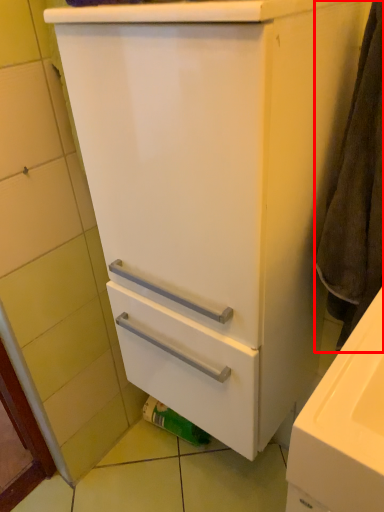
Question: From the image's perspective, what is the correct spatial positioning of bath towel (annotated by the red box) in reference to toilet paper?

Choices:
 (A) above
 (B) below

Answer: (A)